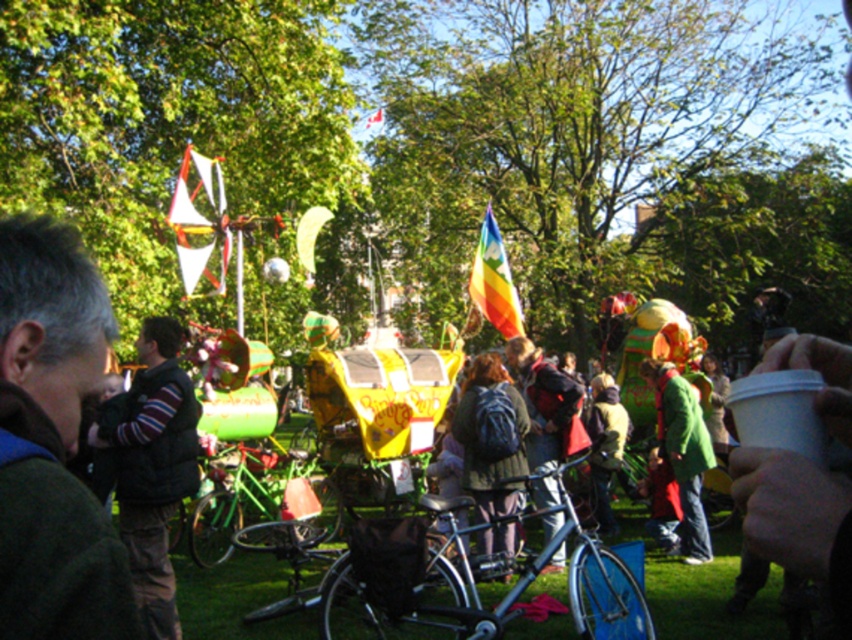
You are standing at the center of the park and want to locate the shiny metallic bicycle at center. What are the coordinates where you should look?

The shiny metallic bicycle at center is located at coordinates point (478, 593).

You are a participant in the festival and want to take a photo of the green fabric jacket at left and the white fabric flag at upper left. To ensure both are in the frame, where should you position yourself relative to the jacket?

You should position yourself below the green fabric jacket at left so that the white fabric flag at upper left is above it, ensuring both are visible in the frame since the jacket is under the flag.